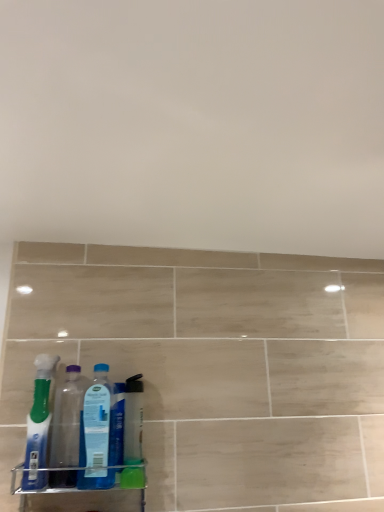
Question: Is blue translucent bottle at center, the first bottle when ordered from right to left, not inside clear plastic spray bottle at center?

Choices:
 (A) yes
 (B) no

Answer: (A)

Question: Is blue translucent bottle at center, the first bottle when ordered from right to left, aimed at clear plastic spray bottle at center?

Choices:
 (A) yes
 (B) no

Answer: (B)

Question: Is the position of blue translucent bottle at center, the 3th bottle in the left-to-right sequence, more distant than that of clear plastic spray bottle at center?

Choices:
 (A) no
 (B) yes

Answer: (A)

Question: Does blue translucent bottle at center, the 3th bottle in the left-to-right sequence, lie in front of clear plastic spray bottle at center?

Choices:
 (A) no
 (B) yes

Answer: (B)

Question: Is blue translucent bottle at center, the 3th bottle in the left-to-right sequence, to the left of clear plastic spray bottle at center from the viewer's perspective?

Choices:
 (A) yes
 (B) no

Answer: (A)

Question: Visually, is transparent plastic bottle at left, the 2th bottle positioned from the left, positioned to the left or to the right of translucent blue toothbrush at left, the 3th bottle from the right?

Choices:
 (A) right
 (B) left

Answer: (A)

Question: Considering their positions, is transparent plastic bottle at left, the 2th bottle when ordered from right to left, located in front of or behind translucent blue toothbrush at left, marked as the 1th bottle in a left-to-right arrangement?

Choices:
 (A) behind
 (B) front

Answer: (A)

Question: From a real-world perspective, is transparent plastic bottle at left, the 2th bottle when ordered from right to left, physically located above or below translucent blue toothbrush at left, the 3th bottle from the right?

Choices:
 (A) above
 (B) below

Answer: (B)

Question: Do you think transparent plastic bottle at left, the 2th bottle when ordered from right to left, is within translucent blue toothbrush at left, the 3th bottle from the right, or outside of it?

Choices:
 (A) outside
 (B) inside

Answer: (A)

Question: Would you say clear plastic spray bottle at center is inside or outside blue translucent bottle at center, the 3th bottle in the left-to-right sequence?

Choices:
 (A) outside
 (B) inside

Answer: (A)

Question: In the image, is clear plastic spray bottle at center on the left side or the right side of blue translucent bottle at center, the first bottle when ordered from right to left?

Choices:
 (A) right
 (B) left

Answer: (A)

Question: Is clear plastic spray bottle at center in front of or behind blue translucent bottle at center, the 3th bottle in the left-to-right sequence, in the image?

Choices:
 (A) front
 (B) behind

Answer: (B)

Question: Considering the positions of point (135, 458) and point (94, 436), is point (135, 458) closer or farther from the camera than point (94, 436)?

Choices:
 (A) closer
 (B) farther

Answer: (B)

Question: Is translucent blue toothbrush at left, marked as the 1th bottle in a left-to-right arrangement, inside the boundaries of transparent plastic bottle at left, the 2th bottle positioned from the left, or outside?

Choices:
 (A) outside
 (B) inside

Answer: (A)

Question: Looking at their shapes, would you say translucent blue toothbrush at left, the 3th bottle from the right, is wider or thinner than transparent plastic bottle at left, the 2th bottle when ordered from right to left?

Choices:
 (A) wide
 (B) thin

Answer: (A)